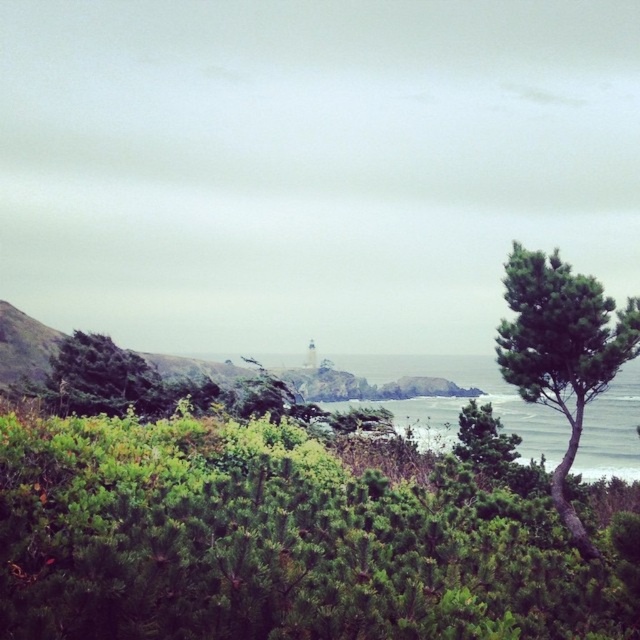
You are standing in the coastal landscape and want to take a photo of both the green leafy tree at right and the green leafy tree at left. Which tree should you focus on first to ensure both are in the frame?

You should focus on the green leafy tree at left first because it is farther away from you than the green leafy tree at right, so adjusting the focus to the farther tree will help keep both in the frame.